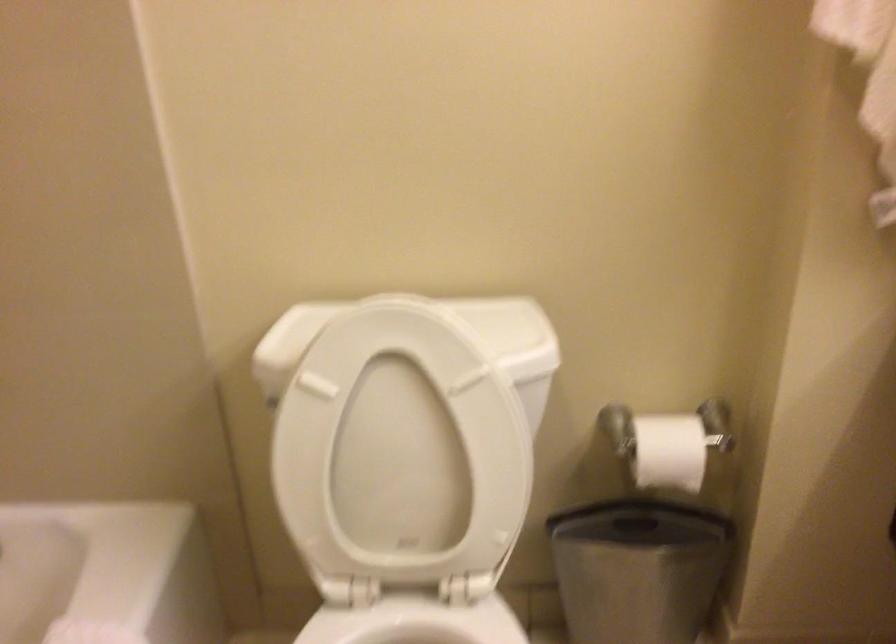
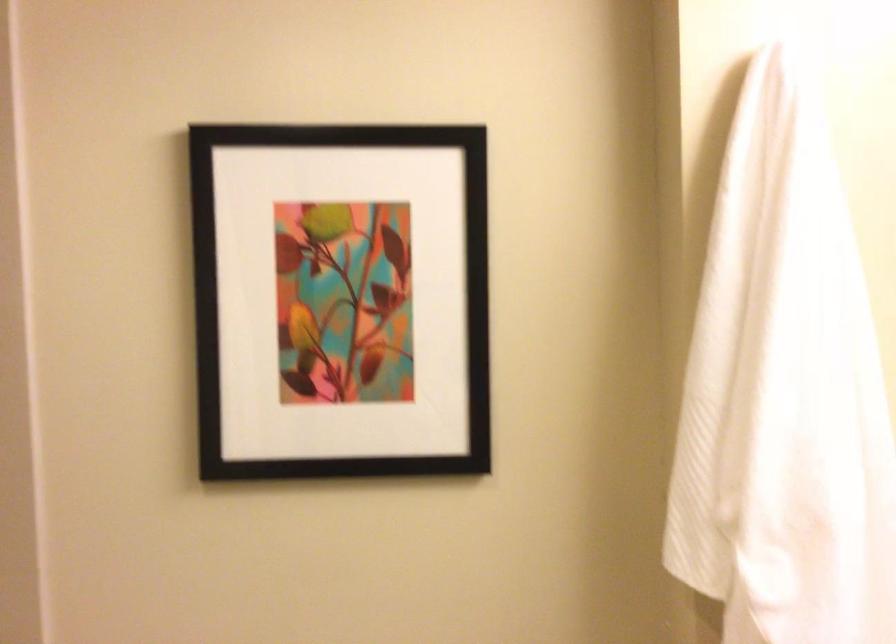
The images are taken continuously from a first-person perspective. In which direction are you moving?

The cameraman walked toward right, backward.